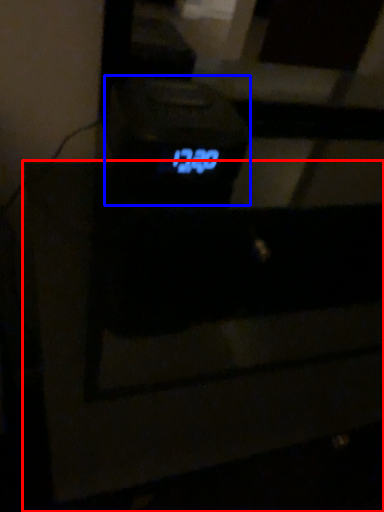
Question: Among these objects, which one is farthest to the camera, furniture (highlighted by a red box) or digital clock (highlighted by a blue box)?

Choices:
 (A) furniture
 (B) digital clock

Answer: (B)